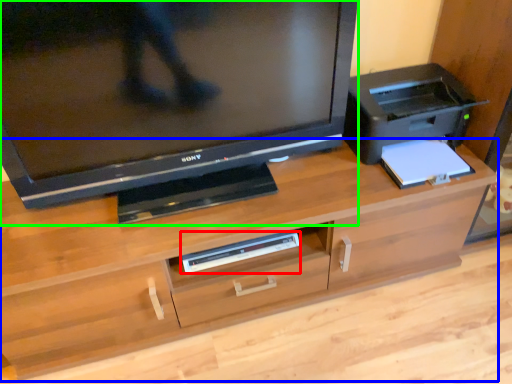
Question: Which object is positioned farthest from equipment (highlighted by a red box)? Select from desk (highlighted by a blue box) and television (highlighted by a green box).

Choices:
 (A) desk
 (B) television

Answer: (B)